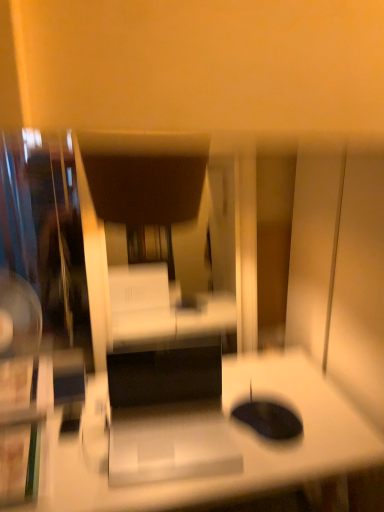
Question: Can you confirm if dark brown leather swivel chair at center is taller than white glossy desk at center?

Choices:
 (A) yes
 (B) no

Answer: (B)

Question: From a real-world perspective, is dark brown leather swivel chair at center physically above white glossy desk at center?

Choices:
 (A) yes
 (B) no

Answer: (A)

Question: Can you confirm if dark brown leather swivel chair at center is wider than white glossy desk at center?

Choices:
 (A) no
 (B) yes

Answer: (A)

Question: Is the depth of dark brown leather swivel chair at center greater than that of white glossy desk at center?

Choices:
 (A) no
 (B) yes

Answer: (B)

Question: Can you confirm if dark brown leather swivel chair at center is bigger than white glossy desk at center?

Choices:
 (A) yes
 (B) no

Answer: (B)

Question: Does dark brown leather swivel chair at center have a lesser height compared to white glossy desk at center?

Choices:
 (A) no
 (B) yes

Answer: (B)

Question: Considering the relative sizes of white glossy desk at center and dark brown leather swivel chair at center in the image provided, is white glossy desk at center smaller than dark brown leather swivel chair at center?

Choices:
 (A) yes
 (B) no

Answer: (B)

Question: Is dark brown leather swivel chair at center a part of white glossy desk at center?

Choices:
 (A) yes
 (B) no

Answer: (B)

Question: Considering the relative sizes of white glossy desk at center and dark brown leather swivel chair at center in the image provided, is white glossy desk at center shorter than dark brown leather swivel chair at center?

Choices:
 (A) no
 (B) yes

Answer: (A)

Question: From the image's perspective, is white glossy desk at center under dark brown leather swivel chair at center?

Choices:
 (A) no
 (B) yes

Answer: (B)

Question: Is white glossy desk at center aimed at dark brown leather swivel chair at center?

Choices:
 (A) no
 (B) yes

Answer: (A)

Question: Does white glossy desk at center lie behind dark brown leather swivel chair at center?

Choices:
 (A) yes
 (B) no

Answer: (B)

Question: From a real-world perspective, relative to dark brown leather swivel chair at center, is white glossy desk at center vertically above or below?

Choices:
 (A) below
 (B) above

Answer: (A)